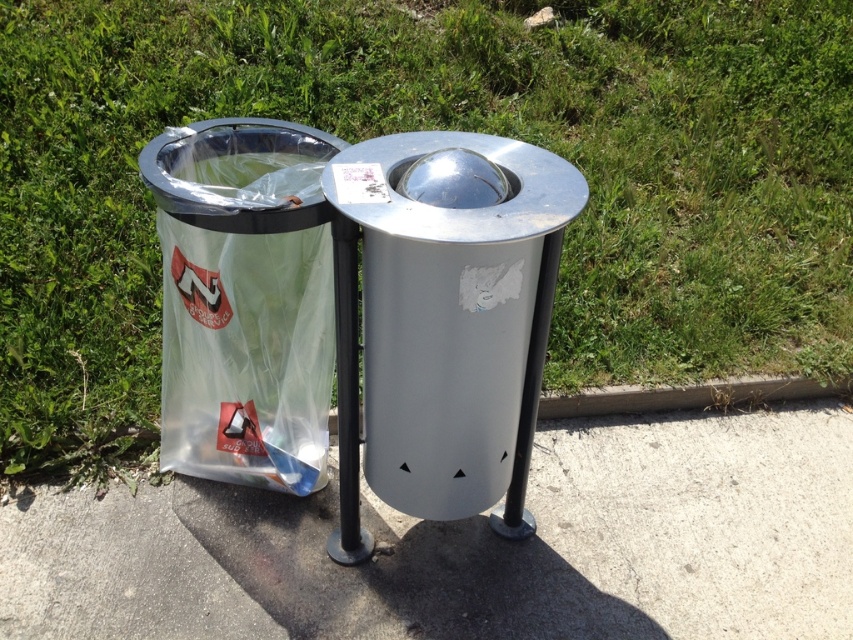
Question: Among these points, which one is nearest to the camera?

Choices:
 (A) (258, 262)
 (B) (851, 509)

Answer: (A)

Question: Does gray concrete pavement at lower center appear on the left side of clear plastic bag at left?

Choices:
 (A) no
 (B) yes

Answer: (A)

Question: Which point is farther to the camera?

Choices:
 (A) clear plastic bag at left
 (B) gray concrete pavement at lower center

Answer: (B)

Question: Is gray concrete pavement at lower center closer to camera compared to clear plastic bag at left?

Choices:
 (A) yes
 (B) no

Answer: (B)

Question: Is gray concrete pavement at lower center thinner than clear plastic bag at left?

Choices:
 (A) yes
 (B) no

Answer: (B)

Question: Which point is closer to the camera taking this photo?

Choices:
 (A) (209, 195)
 (B) (6, 552)

Answer: (A)